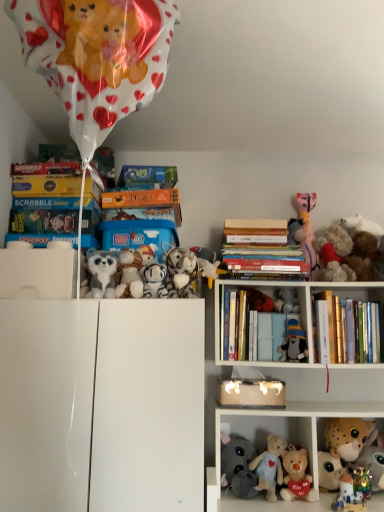
What is the approximate height of gray plush elephant at lower center, which ranks as the fourth toy in left-to-right order?

7.70 inches.

Where is `hardcover book at upper center, the third book ordered from the bottom`? The height and width of the screenshot is (512, 384). hardcover book at upper center, the third book ordered from the bottom is located at coordinates (144, 213).

Locate an element on the screen. The width and height of the screenshot is (384, 512). green cardboard book at upper center, the first book in the top-to-bottom sequence is located at coordinates (147, 176).

This screenshot has height=512, width=384. What do you see at coordinates (353, 329) in the screenshot?
I see `hardcover books at upper right, the first book from the right` at bounding box center [353, 329].

Find the location of a particular element. fluffy plush toys at right, the 3th toy positioned from the right is located at coordinates (334, 254).

I want to click on shiny metallic balloon at upper left, so click(x=96, y=57).

Locate an element on the screen. The image size is (384, 512). book below the fluffy white plush at upper left, the 1th toy when ordered from left to right (from a real-world perspective) is located at coordinates (353, 329).

Does fluffy white plush at upper left, the 12th toy viewed from the right, lie behind hardcover books at upper right, the first book from the right?

No, fluffy white plush at upper left, the 12th toy viewed from the right, is in front of hardcover books at upper right, the first book from the right.

From the image's perspective, relative to hardcover books at upper right, which appears as the first book when ordered from the bottom, is fluffy white plush at upper left, the 1th toy when ordered from left to right, above or below?

fluffy white plush at upper left, the 1th toy when ordered from left to right, is situated higher than hardcover books at upper right, which appears as the first book when ordered from the bottom, in the image.

Could you tell me if brown plush toy at upper right, placed as the 1th toy when sorted from right to left, is turned towards plush pink toy at upper right, which is counted as the 8th toy, starting from the left?

No, brown plush toy at upper right, placed as the 1th toy when sorted from right to left, is not facing towards plush pink toy at upper right, which is counted as the 8th toy, starting from the left.

Which of these two, brown plush toy at upper right, placed as the 1th toy when sorted from right to left, or plush pink toy at upper right, which ranks as the 5th toy in right-to-left order, is bigger?

brown plush toy at upper right, placed as the 1th toy when sorted from right to left.

From the image's perspective, which is above, brown plush toy at upper right, placed as the twelfth toy when sorted from left to right, or plush pink toy at upper right, which is counted as the 8th toy, starting from the left?

Result: plush pink toy at upper right, which is counted as the 8th toy, starting from the left, appears higher in the image.

Would you say brown plush toy at upper right, placed as the twelfth toy when sorted from left to right, is a long distance from plush pink toy at upper right, which is counted as the 8th toy, starting from the left?

No, brown plush toy at upper right, placed as the twelfth toy when sorted from left to right, is not far from plush pink toy at upper right, which is counted as the 8th toy, starting from the left.

Locate an element on the screen. The height and width of the screenshot is (512, 384). the 2nd book below the hardcover book at upper center, the second book when ordered from top to bottom (from the image's perspective) is located at coordinates point(353,329).

Looking at this image, is hardcover books at upper right, the first book from the right, at the left side of hardcover book at upper center, the third book ordered from the bottom?

In fact, hardcover books at upper right, the first book from the right, is to the right of hardcover book at upper center, the third book ordered from the bottom.

Is hardcover books at upper right, the first book from the right, not close to hardcover book at upper center, the third book ordered from the bottom?

No, hardcover books at upper right, the first book from the right, is in close proximity to hardcover book at upper center, the third book ordered from the bottom.

Is gray plush toy at upper center, the sixth toy in the left-to-right sequence, located outside hardcover books at upper right, the first book from the right?

Yes.

You are a GUI agent. You are given a task and a screenshot of the screen. Output one action in this format:
    pyautogui.click(x=<x>, y=<y>)
    Task: Click on the toy that is the 6th one when counting leftward from the hardcover books at upper right, which appears as the first book when ordered from the bottom
    This screenshot has height=512, width=384.
    Given the screenshot: What is the action you would take?
    [286, 301]

Is gray plush toy at upper center, which is the seventh toy from right to left, at the right side of hardcover books at upper right, the first book from the right?

In fact, gray plush toy at upper center, which is the seventh toy from right to left, is to the left of hardcover books at upper right, the first book from the right.

From the image's perspective, is gray plush toy at upper center, the sixth toy in the left-to-right sequence, above hardcover books at upper right, which is the fourth book in left-to-right order?

Yes, from the image's perspective, gray plush toy at upper center, the sixth toy in the left-to-right sequence, is over hardcover books at upper right, which is the fourth book in left-to-right order.

Identify the location of the 1st shelf directly above the soft plush bear at center, which is the 5th toy in left-to-right order (from a real-world perspective). (102, 405).

From the image's perspective, between white glossy cabinet at center, the 2th shelf viewed from the right, and soft plush bear at center, which is the 8th toy from right to left, which one is located above?

white glossy cabinet at center, the 2th shelf viewed from the right, from the image's perspective.

Between white glossy cabinet at center, the 2th shelf viewed from the right, and soft plush bear at center, which is the 8th toy from right to left, which one has larger size?

With larger size is white glossy cabinet at center, the 2th shelf viewed from the right.

Is white glossy cabinet at center, the 2th shelf viewed from the right, to the left of soft plush bear at center, which is the 8th toy from right to left, from the viewer's perspective?

Indeed, white glossy cabinet at center, the 2th shelf viewed from the right, is positioned on the left side of soft plush bear at center, which is the 8th toy from right to left.

Who is taller, green cardboard book at upper center, the first book in the top-to-bottom sequence, or hardcover books at upper right, the first shelf in the right-to-left sequence?

hardcover books at upper right, the first shelf in the right-to-left sequence.

Is green cardboard book at upper center, the 2th book viewed from the left, aimed at hardcover books at upper right, positioned as the 2th shelf in left-to-right order?

No, green cardboard book at upper center, the 2th book viewed from the left, is not facing towards hardcover books at upper right, positioned as the 2th shelf in left-to-right order.

Is green cardboard book at upper center, the third book in the right-to-left sequence, outside of hardcover books at upper right, the first shelf in the right-to-left sequence?

Yes, green cardboard book at upper center, the third book in the right-to-left sequence, is outside of hardcover books at upper right, the first shelf in the right-to-left sequence.

Is green cardboard book at upper center, the third book in the right-to-left sequence, in front of hardcover books at upper right, the first shelf in the right-to-left sequence?

No, green cardboard book at upper center, the third book in the right-to-left sequence, is further to the viewer.

Could you measure the distance between hardcover book at upper center, the second book when ordered from top to bottom, and hardcover books at center, which is counted as the third book, starting from the top?

12.95 inches.

Does point (132, 218) appear closer or farther from the camera than point (255, 229)?

Point (132, 218) is positioned closer to the camera compared to point (255, 229).

Locate an element on the screen. The image size is (384, 512). the 1st book above the hardcover books at center, which is counted as the third book, starting from the top (from the image's perspective) is located at coordinates (144, 213).

Can hardcover books at center, the 2th book when ordered from right to left, be found inside hardcover book at upper center, the third book ordered from the bottom?

Actually, hardcover books at center, the 2th book when ordered from right to left, is outside hardcover book at upper center, the third book ordered from the bottom.

This screenshot has width=384, height=512. What are the coordinates of `the 7th toy in front of the hardcover books at upper right, which appears as the first book when ordered from the bottom, starting your count from the anchor` in the screenshot? It's located at (101, 274).

What are the coordinates of `the 3rd toy behind the brown plush toy at upper right, placed as the twelfth toy when sorted from left to right` in the screenshot? It's located at (306, 230).

Looking at this image, looking at the image, which one is located closer to green cardboard book at upper center, the first book in the top-to-bottom sequence, shiny metallic robot at lower right, the ninth toy in the left-to-right sequence, or plush pink toy at upper right, which is counted as the 8th toy, starting from the left?

plush pink toy at upper right, which is counted as the 8th toy, starting from the left, lies closer to green cardboard book at upper center, the first book in the top-to-bottom sequence, than the other object.

Considering their positions, is hardcover book at upper center, the third book ordered from the bottom, positioned closer to fluffy plush toys at right, the 3th toy positioned from the right, than white plush toy at upper center, the tenth toy from the right?

white plush toy at upper center, the tenth toy from the right, is closer to fluffy plush toys at right, the 3th toy positioned from the right.

Considering their positions, is fluffy plush toys at right, the 3th toy positioned from the right, positioned closer to white plush tiger at upper center, marked as the second toy in a left-to-right arrangement, than green cardboard book at upper center, the third book in the right-to-left sequence?

green cardboard book at upper center, the third book in the right-to-left sequence, lies closer to white plush tiger at upper center, marked as the second toy in a left-to-right arrangement, than the other object.

Considering their positions, is blue cardboard box at center positioned further to shiny metallic balloon at upper left than white plush toy at upper center, which is the 7th toy from left to right?

The object further to shiny metallic balloon at upper left is white plush toy at upper center, which is the 7th toy from left to right.

In the scene shown: Based on their spatial positions, is hardcover books at center, the 2th book when ordered from right to left, or fluffy plush toys at right, arranged as the tenth toy when viewed from the left, further from hardcover books at upper right, the 4th book positioned from the top?

Based on the image, hardcover books at center, the 2th book when ordered from right to left, appears to be further to hardcover books at upper right, the 4th book positioned from the top.

From the image, which object appears to be nearer to shiny metallic balloon at upper left, white plush toy at upper center, the 6th toy positioned from the right, or hardcover book at upper center, which appears as the 4th book when viewed from the right?

Based on the image, hardcover book at upper center, which appears as the 4th book when viewed from the right, appears to be nearer to shiny metallic balloon at upper left.

When comparing their distances from hardcover books at upper right, the first book from the right, does white glossy cabinet at center, the 2th shelf viewed from the right, or green cardboard book at upper center, the third book in the right-to-left sequence, seem closer?

white glossy cabinet at center, the 2th shelf viewed from the right.

Based on the photo, from the image, which object appears to be farther from hardcover books at upper right, the first shelf in the right-to-left sequence, green cardboard book at upper center, the third book in the right-to-left sequence, or hardcover book at upper center, the second book when ordered from top to bottom?

green cardboard book at upper center, the third book in the right-to-left sequence.

Locate an element on the screen. The width and height of the screenshot is (384, 512). cabinet between brown plush toy at upper right, placed as the 1th toy when sorted from right to left, and gray plush elephant at lower center, which is the ninth toy from right to left, from top to bottom is located at coordinates (217, 462).

This screenshot has width=384, height=512. Identify the location of book between hardcover books at upper right, the first shelf in the right-to-left sequence, and soft plush bear at center, which is the 8th toy from right to left, in the up-down direction. (353, 329).

Identify the location of shelf situated between white glossy cabinet at center, the 2th shelf viewed from the right, and fluffy plush toys at right, the 3th toy positioned from the right, from left to right. (359, 327).

This screenshot has width=384, height=512. I want to click on cabinet that lies between white plush toy at upper center, the 6th toy positioned from the right, and gray plush elephant at lower center, which is the ninth toy from right to left, from top to bottom, so click(217, 462).